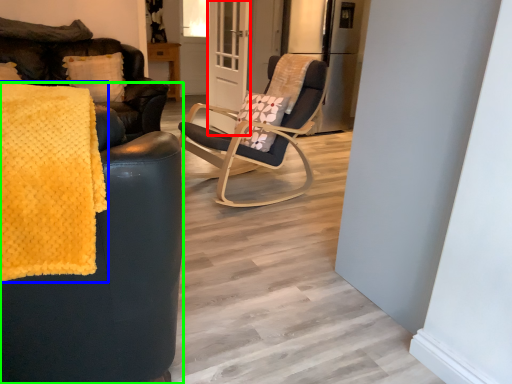
Question: Which object is the farthest from screen door (highlighted by a red box)? Choose among these: blanket (highlighted by a blue box) or chair (highlighted by a green box).

Choices:
 (A) blanket
 (B) chair

Answer: (A)